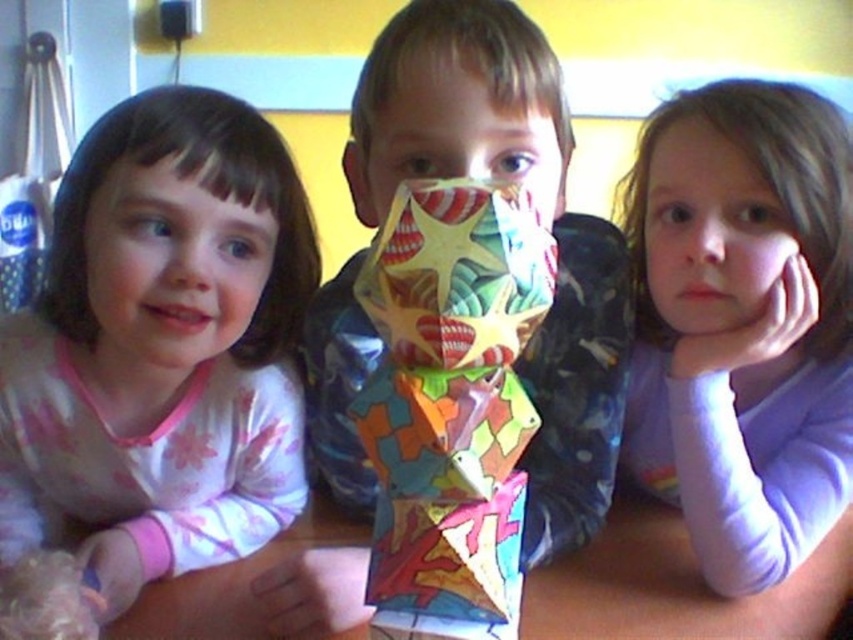
Question: Estimate the real-world distances between objects in this image. Which object is farther from the matte pink pajamas at left?

Choices:
 (A) wooden table at center
 (B) multicolored paper mask at center
 (C) pink fabric face at left

Answer: (B)

Question: Which point appears farthest from the camera in this image?

Choices:
 (A) (244, 323)
 (B) (148, 387)

Answer: (B)

Question: Is matte pink pajamas at left bigger than wooden table at center?

Choices:
 (A) no
 (B) yes

Answer: (B)

Question: Does purple soft fabric at upper right have a lesser width compared to wooden table at center?

Choices:
 (A) no
 (B) yes

Answer: (B)

Question: Is matte pink pajamas at left in front of multicolored paper origami at center?

Choices:
 (A) no
 (B) yes

Answer: (A)

Question: Which of the following is the closest to the observer?

Choices:
 (A) (212, 616)
 (B) (795, 394)
 (C) (177, 176)

Answer: (C)